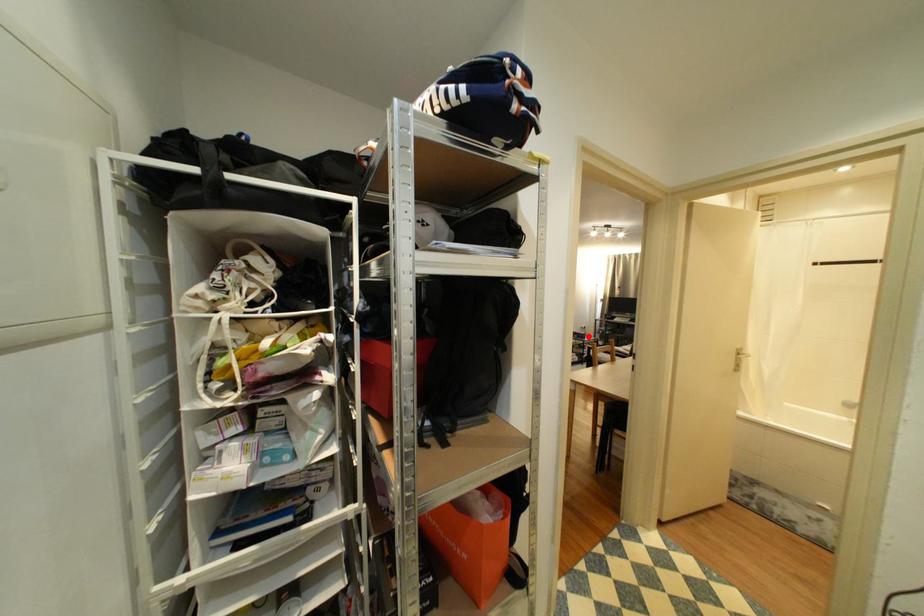
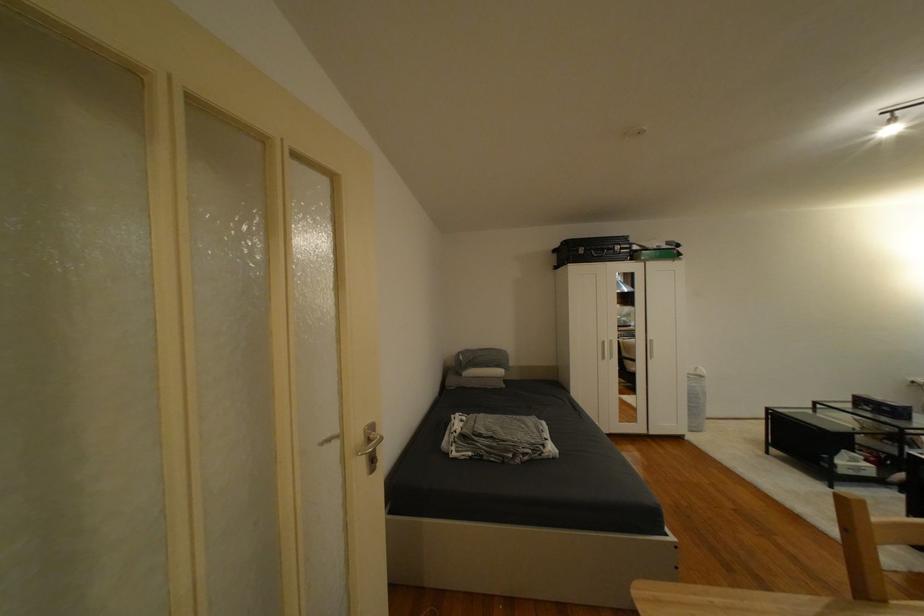
In the second image, find the point that corresponds to the highlighted location in the first image.

(894, 410)